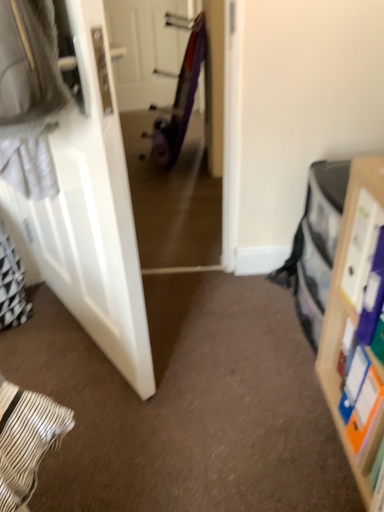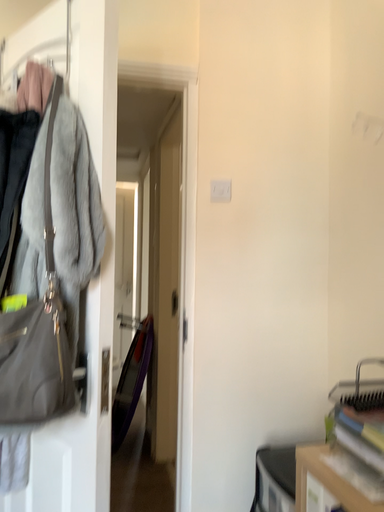
Question: Which way did the camera rotate in the video?

Choices:
 (A) rotated right
 (B) rotated left

Answer: (A)